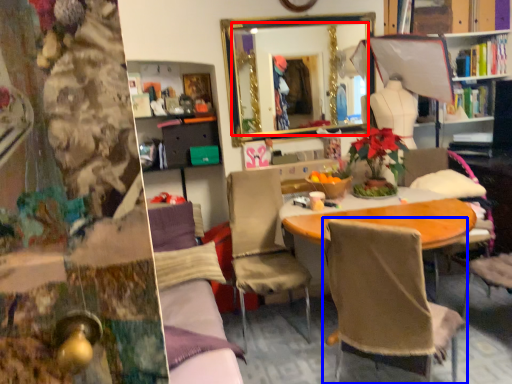
Question: Among these objects, which one is nearest to the camera, mirror (highlighted by a red box) or chair (highlighted by a blue box)?

Choices:
 (A) mirror
 (B) chair

Answer: (B)